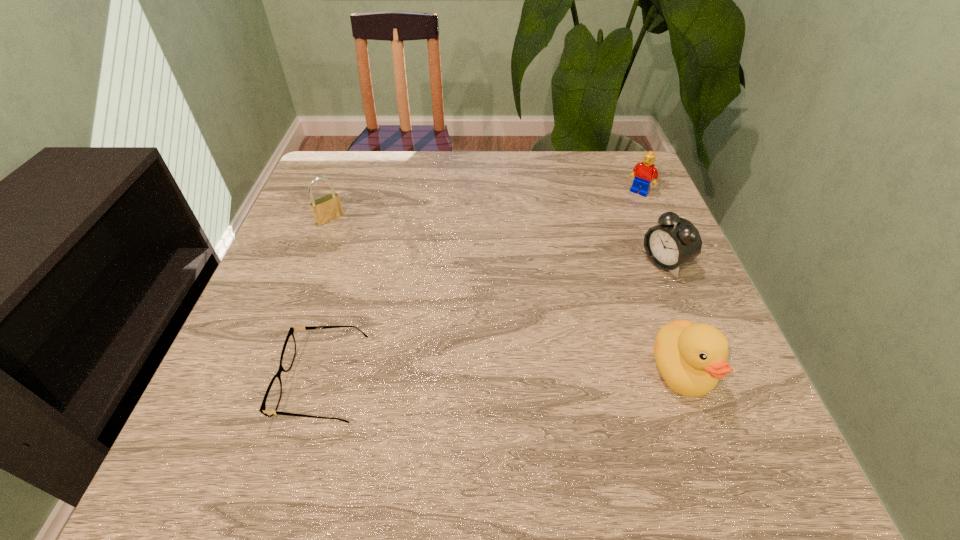
Where is `free space between the duck and the shortest object`? The image size is (960, 540). free space between the duck and the shortest object is located at coordinates (502, 377).

Select which object is the second closest to the alarm clock. Please provide its 2D coordinates. Your answer should be formatted as a tuple, i.e. [(x, y)], where the tuple contains the x and y coordinates of a point satisfying the conditions above.

[(644, 172)]

Choose which object is the second nearest neighbor to the third farthest object. Please provide its 2D coordinates. Your answer should be formatted as a tuple, i.e. [(x, y)], where the tuple contains the x and y coordinates of a point satisfying the conditions above.

[(644, 172)]

In order to click on free space that satisfies the following two spatial constraints: 1. on the front side of the fourth nearest object; 2. on the front-facing side of the shortest object in this screenshot , I will do `click(268, 382)`.

I want to click on vacant area that satisfies the following two spatial constraints: 1. on the front side of the fourth nearest object; 2. on the front-facing side of the spectacles, so click(x=268, y=382).

The image size is (960, 540). What are the coordinates of `blank area in the image that satisfies the following two spatial constraints: 1. on the back side of the Lego; 2. on the right side of the third nearest object` in the screenshot? It's located at (636, 192).